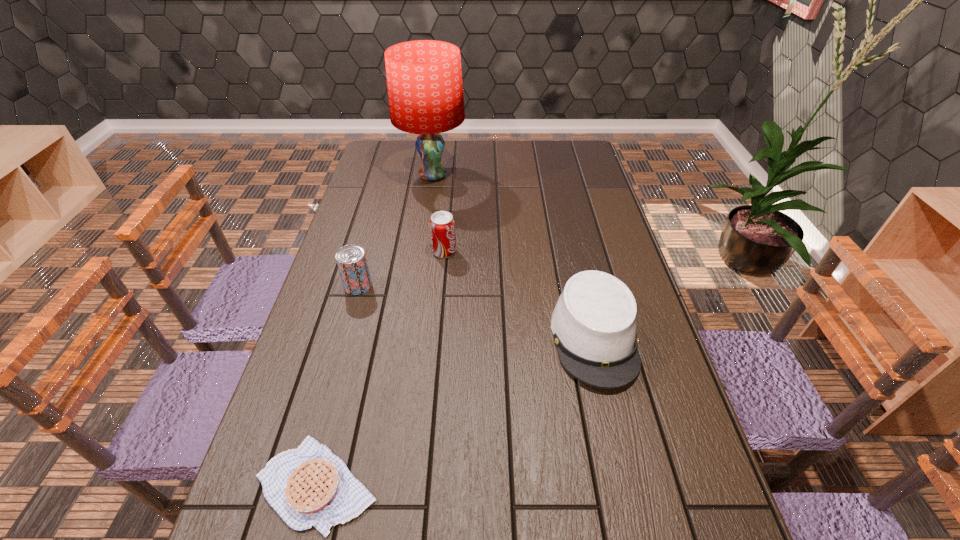
Locate which object is the fourth closest to the farthest object. Please provide its 2D coordinates. Your answer should be formatted as a tuple, i.e. [(x, y)], where the tuple contains the x and y coordinates of a point satisfying the conditions above.

[(309, 486)]